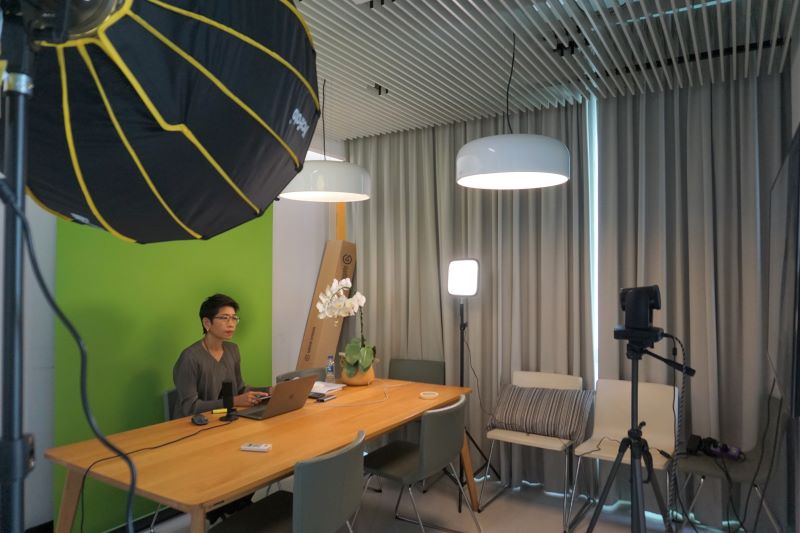
Identify the location of laptop computer. The image size is (800, 533). (286, 391).